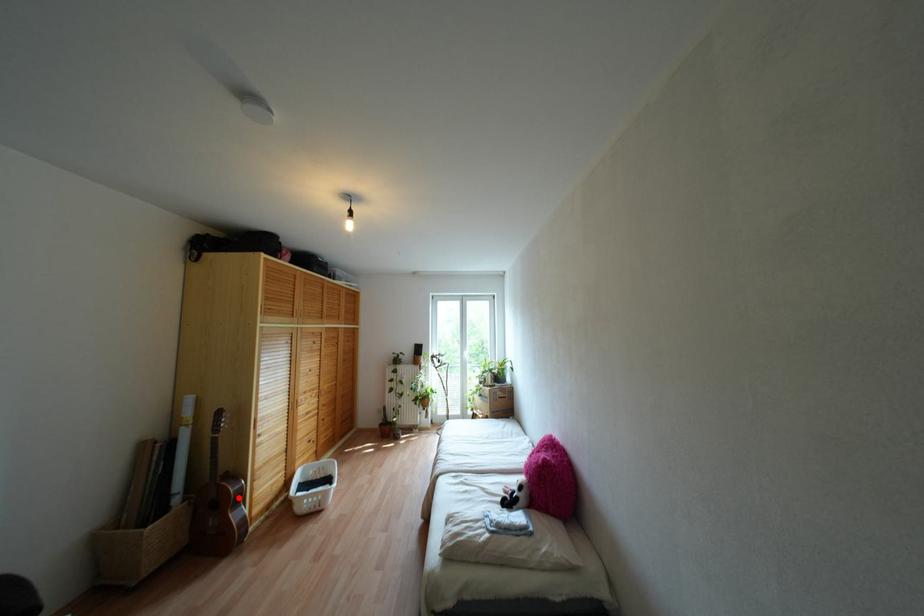
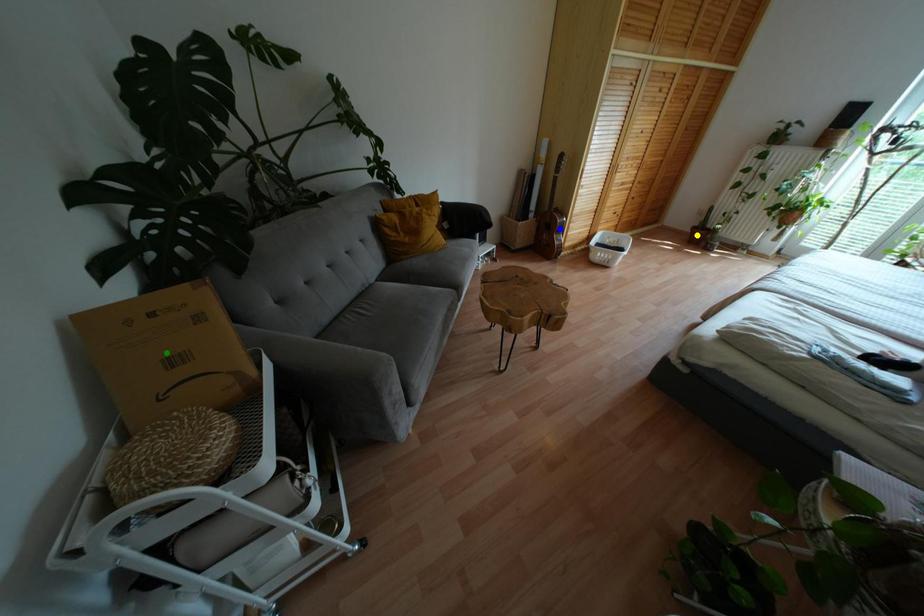
Question: I am providing you with two images of the same scene from different viewpoints. A red point is marked on the first image. You are given multiple points on the second image. In image 2, which mark is for the same physical point as the one in image 1?

Choices:
 (A) yellow point
 (B) blue point
 (C) green point

Answer: (B)